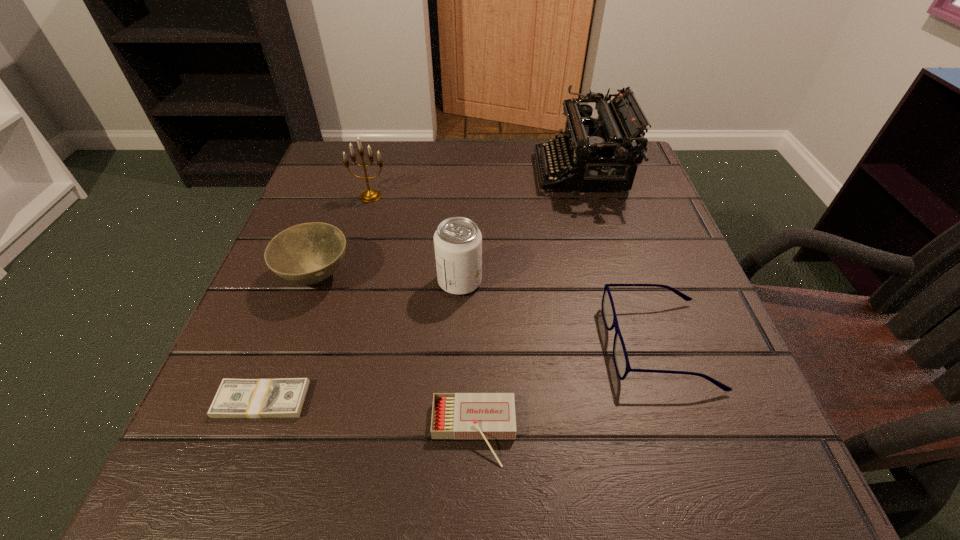
Locate an element on the screen. This screenshot has width=960, height=540. free region at the right edge of the desktop is located at coordinates (632, 267).

Locate an element on the screen. vacant space at the far left corner of the desktop is located at coordinates (386, 157).

Identify the location of free space at the near right corner of the desktop. (764, 503).

The image size is (960, 540). Identify the location of empty location between the second tallest object and the dollar. (316, 298).

Identify the location of free space between the matchbox and the third shortest object. The image size is (960, 540). (566, 389).

Identify the location of unoccupied area between the fifth shortest object and the matchbox. This screenshot has width=960, height=540. (467, 357).

The width and height of the screenshot is (960, 540). I want to click on blank region between the third shortest object and the candelabrum, so click(515, 270).

Find the location of a particular element. The image size is (960, 540). free spot between the matchbox and the shortest object is located at coordinates [368, 416].

At what (x,y) coordinates should I click in order to perform the action: click on vacant area between the shortest object and the fifth tallest object. Please return your answer as a coordinate pair (x, y). The width and height of the screenshot is (960, 540). Looking at the image, I should click on (460, 372).

The image size is (960, 540). What are the coordinates of `free space between the spectacles and the typewriter` in the screenshot? It's located at (620, 258).